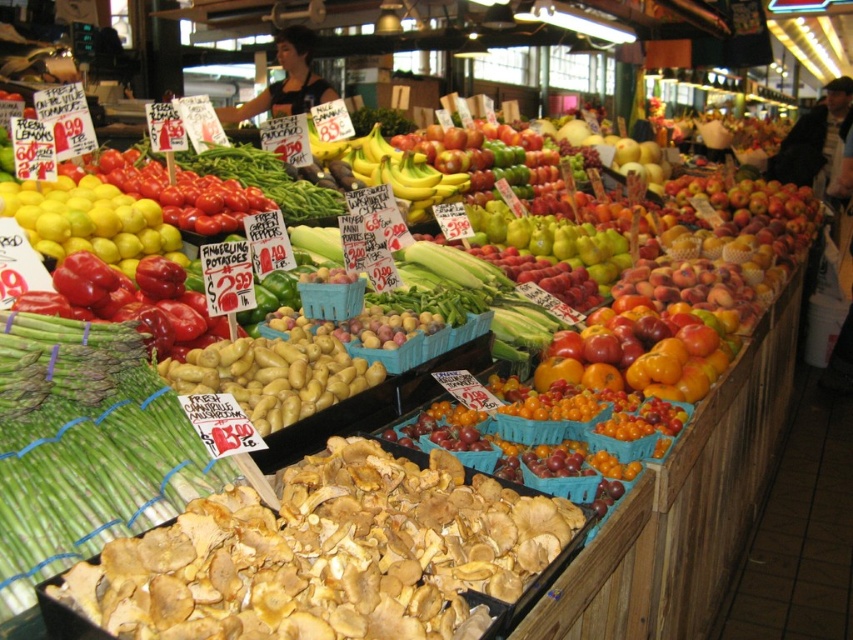
Question: Which object is closer to the camera taking this photo?

Choices:
 (A) green asparagus at left
 (B) matte yellow lemons at left

Answer: (A)

Question: Can you confirm if green asparagus at left is bigger than matte yellow lemons at left?

Choices:
 (A) yes
 (B) no

Answer: (B)

Question: Among these objects, which one is farthest from the camera?

Choices:
 (A) matte yellow lemons at left
 (B) green asparagus at left

Answer: (A)

Question: Does green asparagus at left have a smaller size compared to matte yellow lemons at left?

Choices:
 (A) no
 (B) yes

Answer: (B)

Question: Which point is farther to the camera?

Choices:
 (A) matte yellow lemons at left
 (B) green asparagus at left

Answer: (A)

Question: Is green asparagus at left wider than matte yellow lemons at left?

Choices:
 (A) no
 (B) yes

Answer: (A)